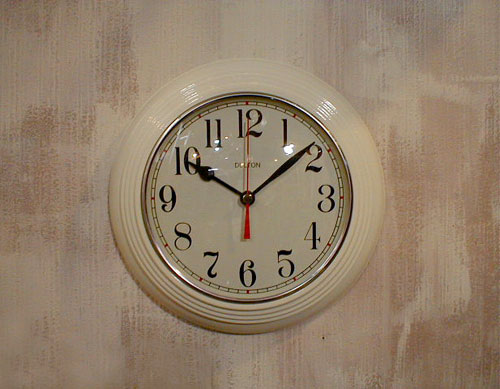
At what (x,y) coordinates should I click in order to perform the action: click on wall clock is on. Please return your answer as a coordinate pair (x, y). The width and height of the screenshot is (500, 389). Looking at the image, I should click on (432, 88).